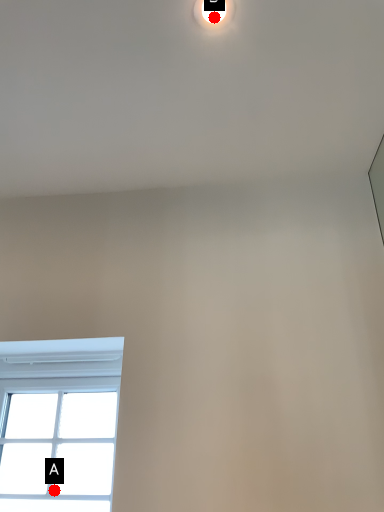
Question: Two points are circled on the image, labeled by A and B beside each circle. Which point is further to the camera?

Choices:
 (A) A is further
 (B) B is further

Answer: (A)